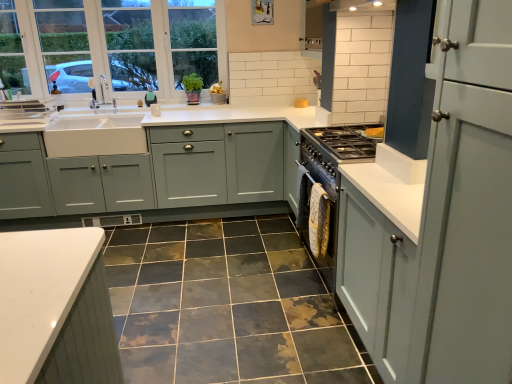
Locate an element on the screen. vacant area on top of marble-like ceramic tile at center (from a real-world perspective) is located at coordinates (195, 276).